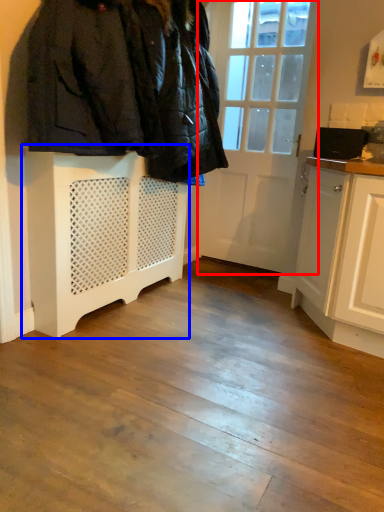
Question: Which of the following is the closest to the observer, door (highlighted by a red box) or cabinetry (highlighted by a blue box)?

Choices:
 (A) door
 (B) cabinetry

Answer: (B)